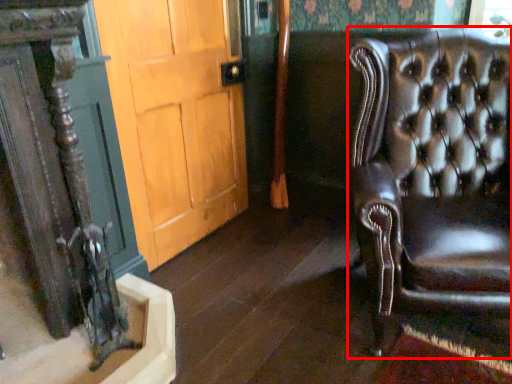
Question: Where is chair (annotated by the red box) located in relation to door in the image?

Choices:
 (A) left
 (B) right

Answer: (B)